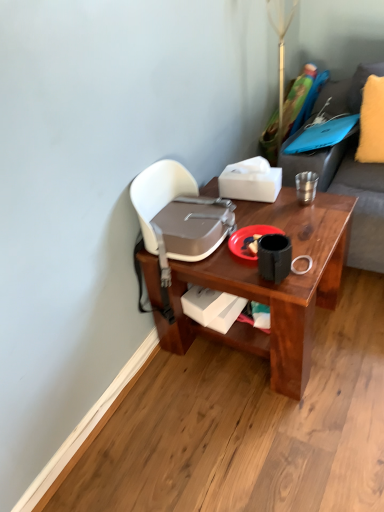
At what (x,y) coordinates should I click in order to perform the action: click on vacant space that's between red matte plate at center and white matte tissue box at upper center, positioned as the 1th box in top-to-bottom order. Please return your answer as a coordinate pair (x, y). Looking at the image, I should click on (262, 216).